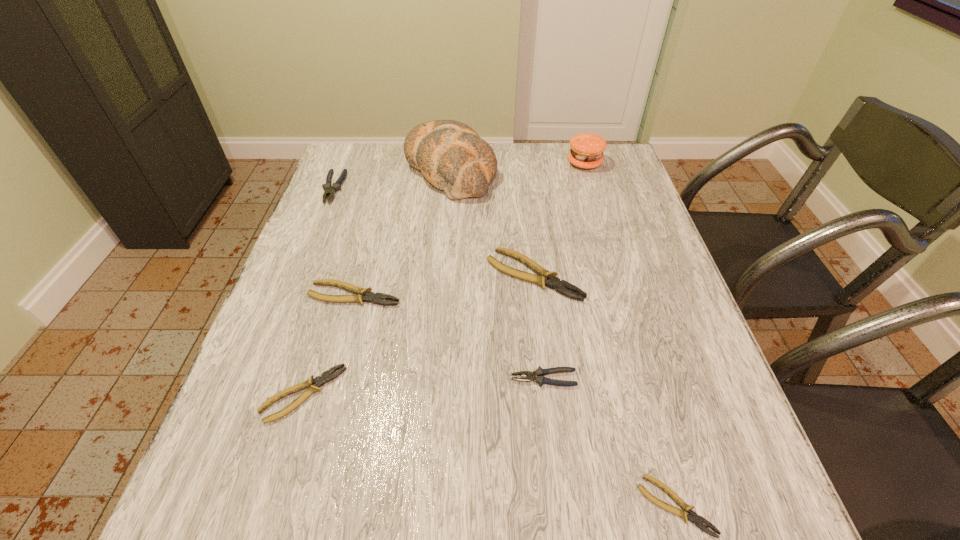
Find the location of a particular element. object positioned at the near right corner is located at coordinates (693, 517).

In the image, there is a desktop. Where is `vacant area at the far edge`? The width and height of the screenshot is (960, 540). vacant area at the far edge is located at coordinates (540, 143).

In the image, there is a desktop. Identify the location of vacant space at the near edge. (490, 519).

You are a GUI agent. You are given a task and a screenshot of the screen. Output one action in this format:
    pyautogui.click(x=<x>, y=<y>)
    Task: Click on the vacant space at the right edge of the desktop
    This screenshot has height=540, width=960.
    Given the screenshot: What is the action you would take?
    (x=622, y=212)

Locate an element on the screen. free space at the far left corner of the desktop is located at coordinates (349, 159).

Image resolution: width=960 pixels, height=540 pixels. In the image, there is a desktop. Identify the location of vacant space at the far right corner. (609, 161).

In the image, there is a desktop. At what (x,y) coordinates should I click in order to perform the action: click on vacant space at the near right corner. Please return your answer as a coordinate pair (x, y). The height and width of the screenshot is (540, 960). Looking at the image, I should click on (678, 486).

I want to click on empty space that is in between the biggest yellow pliers and the smallest yellow pliers, so click(x=605, y=390).

I want to click on vacant area that lies between the smallest yellow pliers and the third smallest yellow pliers, so click(516, 400).

Locate an element on the screen. This screenshot has height=540, width=960. vacant area between the third smallest yellow pliers and the shortest pliers is located at coordinates (516, 400).